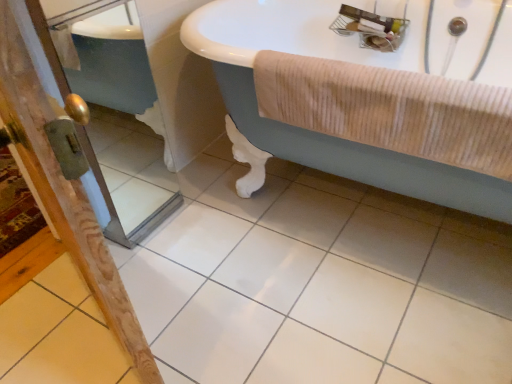
Question: Is white glossy tile at center further to the viewer compared to wooden screen door at left, the first screen door positioned from the left?

Choices:
 (A) yes
 (B) no

Answer: (B)

Question: Does white glossy tile at center have a greater height compared to wooden screen door at left, the second screen door viewed from the right?

Choices:
 (A) no
 (B) yes

Answer: (A)

Question: From the image's perspective, is white glossy tile at center on top of wooden screen door at left, the second screen door viewed from the right?

Choices:
 (A) yes
 (B) no

Answer: (B)

Question: From the image's perspective, would you say white glossy tile at center is shown under wooden screen door at left, the second screen door viewed from the right?

Choices:
 (A) no
 (B) yes

Answer: (B)

Question: Does white glossy tile at center have a larger size compared to wooden screen door at left, the second screen door viewed from the right?

Choices:
 (A) yes
 (B) no

Answer: (A)

Question: Is white glossy bathtub at upper center wider or thinner than wooden screen door at lower left, placed as the first screen door when sorted from right to left?

Choices:
 (A) thin
 (B) wide

Answer: (B)

Question: Is white glossy bathtub at upper center taller or shorter than wooden screen door at lower left, placed as the first screen door when sorted from right to left?

Choices:
 (A) short
 (B) tall

Answer: (A)

Question: Which is correct: white glossy bathtub at upper center is inside wooden screen door at lower left, the second screen door from the left, or outside of it?

Choices:
 (A) outside
 (B) inside

Answer: (A)

Question: In the image, is white glossy bathtub at upper center on the left side or the right side of wooden screen door at lower left, placed as the first screen door when sorted from right to left?

Choices:
 (A) right
 (B) left

Answer: (A)

Question: Considering the relative positions of wooden screen door at lower left, the second screen door from the left, and white glossy tile at center in the image provided, is wooden screen door at lower left, the second screen door from the left, to the left or to the right of white glossy tile at center?

Choices:
 (A) left
 (B) right

Answer: (A)

Question: From their relative heights in the image, would you say wooden screen door at lower left, placed as the first screen door when sorted from right to left, is taller or shorter than white glossy tile at center?

Choices:
 (A) tall
 (B) short

Answer: (A)

Question: From a real-world perspective, is wooden screen door at lower left, the second screen door from the left, positioned above or below white glossy tile at center?

Choices:
 (A) below
 (B) above

Answer: (B)

Question: Which is correct: wooden screen door at lower left, the second screen door from the left, is inside white glossy tile at center, or outside of it?

Choices:
 (A) inside
 (B) outside

Answer: (B)

Question: From a real-world perspective, is wooden screen door at lower left, placed as the first screen door when sorted from right to left, positioned above or below wooden screen door at left, the second screen door viewed from the right?

Choices:
 (A) below
 (B) above

Answer: (B)

Question: Considering the positions of wooden screen door at lower left, the second screen door from the left, and wooden screen door at left, the second screen door viewed from the right, in the image, is wooden screen door at lower left, the second screen door from the left, taller or shorter than wooden screen door at left, the second screen door viewed from the right,?

Choices:
 (A) short
 (B) tall

Answer: (B)